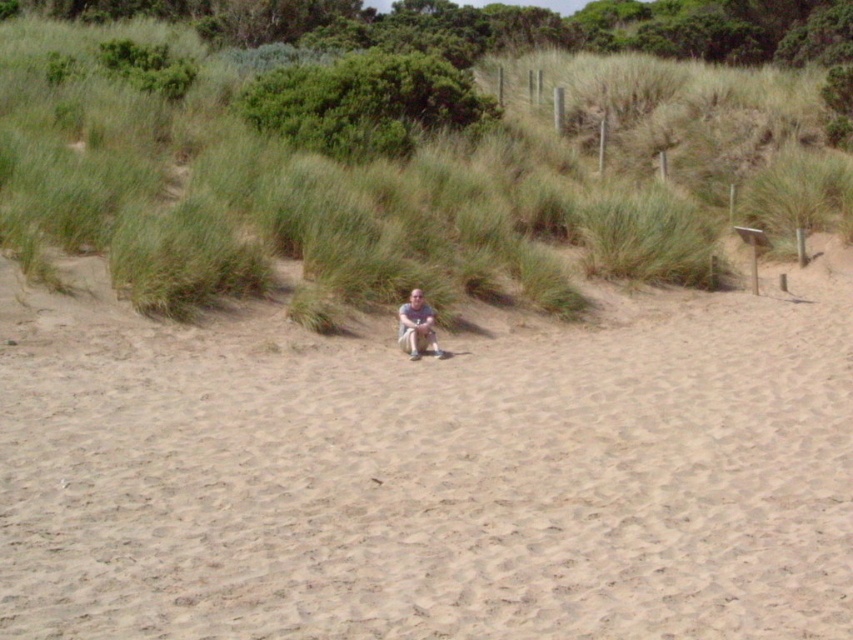
Question: Can you confirm if beige sandy beach at center is positioned below light brown fabric pants at center?

Choices:
 (A) no
 (B) yes

Answer: (B)

Question: Is beige sandy beach at center above light brown fabric pants at center?

Choices:
 (A) yes
 (B) no

Answer: (B)

Question: Which point is farther to the camera?

Choices:
 (A) beige sandy beach at center
 (B) light brown fabric pants at center

Answer: (B)

Question: From the image, what is the correct spatial relationship of beige sandy beach at center in relation to light brown fabric pants at center?

Choices:
 (A) left
 (B) right

Answer: (A)

Question: Which point is farther from the camera taking this photo?

Choices:
 (A) (427, 320)
 (B) (154, 625)

Answer: (A)

Question: Which point appears closest to the camera in this image?

Choices:
 (A) (421, 291)
 (B) (85, 540)

Answer: (B)